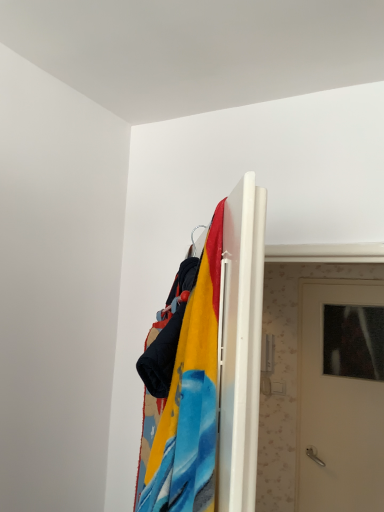
Where is `velvet fabric blanket at upper center`? This screenshot has height=512, width=384. velvet fabric blanket at upper center is located at coordinates (226, 346).

Describe the element at coordinates (226, 346) in the screenshot. I see `velvet fabric blanket at upper center` at that location.

Describe the element at coordinates (341, 396) in the screenshot. I see `white matte door at center` at that location.

Identify the location of white matte door at center. (341, 396).

The height and width of the screenshot is (512, 384). What are the coordinates of `velvet fabric blanket at upper center` in the screenshot? It's located at (226, 346).

Can you confirm if white matte door at center is positioned to the right of velvet fabric blanket at upper center?

Correct, you'll find white matte door at center to the right of velvet fabric blanket at upper center.

Which object is further away from the camera, white matte door at center or velvet fabric blanket at upper center?

white matte door at center is behind.

Is point (329, 362) farther from camera compared to point (257, 388)?

Yes, it is behind point (257, 388).

From the image's perspective, who appears lower, white matte door at center or velvet fabric blanket at upper center?

white matte door at center, from the image's perspective.

From a real-world perspective, who is located higher, white matte door at center or velvet fabric blanket at upper center?

In real-world perspective, velvet fabric blanket at upper center is above.

Which of these two, white matte door at center or velvet fabric blanket at upper center, is thinner?

velvet fabric blanket at upper center.

Can you confirm if white matte door at center is taller than velvet fabric blanket at upper center?

Yes, white matte door at center is taller than velvet fabric blanket at upper center.

In terms of size, does white matte door at center appear bigger or smaller than velvet fabric blanket at upper center?

white matte door at center is bigger than velvet fabric blanket at upper center.

Would you say white matte door at center is outside velvet fabric blanket at upper center?

white matte door at center is positioned outside velvet fabric blanket at upper center.

Is there a large distance between white matte door at center and velvet fabric blanket at upper center?

That's right, there is a large distance between white matte door at center and velvet fabric blanket at upper center.

Is white matte door at center aimed at velvet fabric blanket at upper center?

Yes, white matte door at center is facing velvet fabric blanket at upper center.

You are a GUI agent. You are given a task and a screenshot of the screen. Output one action in this format:
    pyautogui.click(x=<x>, y=<y>)
    Task: Click on the closet on the left of the white matte door at center
    The image size is (384, 512).
    Given the screenshot: What is the action you would take?
    pyautogui.click(x=226, y=346)

Is velvet fabric blanket at upper center to the left or to the right of white matte door at center in the image?

From the image, it's evident that velvet fabric blanket at upper center is to the left of white matte door at center.

Does velvet fabric blanket at upper center come in front of white matte door at center?

Yes.

Does point (223, 284) lie behind point (336, 393)?

No.

Consider the image. From the image's perspective, is velvet fabric blanket at upper center over white matte door at center?

Yes.

From a real-world perspective, between velvet fabric blanket at upper center and white matte door at center, who is vertically lower?

white matte door at center is physically lower.

From the picture: Which of these two, velvet fabric blanket at upper center or white matte door at center, is wider?

white matte door at center.

Considering the sizes of objects velvet fabric blanket at upper center and white matte door at center in the image provided, who is shorter, velvet fabric blanket at upper center or white matte door at center?

With less height is velvet fabric blanket at upper center.

Considering the sizes of objects velvet fabric blanket at upper center and white matte door at center in the image provided, who is smaller, velvet fabric blanket at upper center or white matte door at center?

Smaller between the two is velvet fabric blanket at upper center.

Would you say velvet fabric blanket at upper center is outside white matte door at center?

Indeed, velvet fabric blanket at upper center is completely outside white matte door at center.

Is velvet fabric blanket at upper center directly adjacent to white matte door at center?

No.

Is velvet fabric blanket at upper center oriented towards white matte door at center?

No.

This screenshot has width=384, height=512. Identify the location of door that is under the velvet fabric blanket at upper center (from a real-world perspective). (341, 396).

The image size is (384, 512). Identify the location of door that appears below the velvet fabric blanket at upper center (from a real-world perspective). (341, 396).

The width and height of the screenshot is (384, 512). In order to click on closet positioned vertically above the white matte door at center (from a real-world perspective) in this screenshot , I will do `click(226, 346)`.